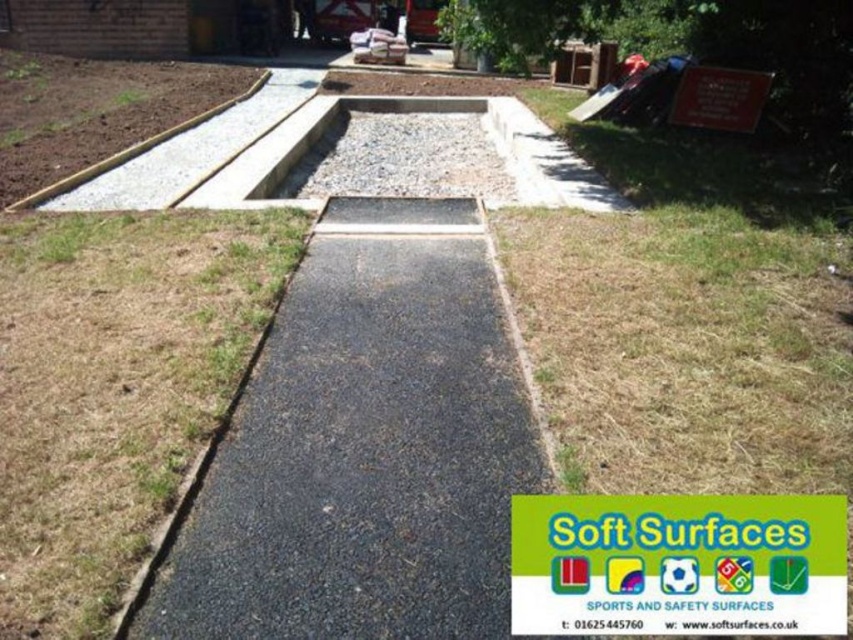
Which of these two, black asphalt pavement at center or dry grass at center, stands taller?

dry grass at center is taller.

Looking at this image, between black asphalt pavement at center and dry grass at center, which one is positioned lower?

black asphalt pavement at center

Does point (189, 545) lie in front of point (61, 336)?

Yes, point (189, 545) is closer to viewer.

This screenshot has height=640, width=853. I want to click on black asphalt pavement at center, so click(x=364, y=449).

Which is above, black asphalt pavement at center or gray gravel at center?

gray gravel at center is higher up.

Does black asphalt pavement at center have a lesser height compared to gray gravel at center?

A: No.

Measure the distance between black asphalt pavement at center and camera.

black asphalt pavement at center is 2.13 meters away from camera.

Locate an element on the screen. black asphalt pavement at center is located at coordinates (364, 449).

Is dry grass at center above gray gravel at center?

Actually, dry grass at center is below gray gravel at center.

Does dry grass at center have a greater height compared to gray gravel at center?

Correct, dry grass at center is much taller as gray gravel at center.

This screenshot has height=640, width=853. Find the location of `dry grass at center`. dry grass at center is located at coordinates (114, 388).